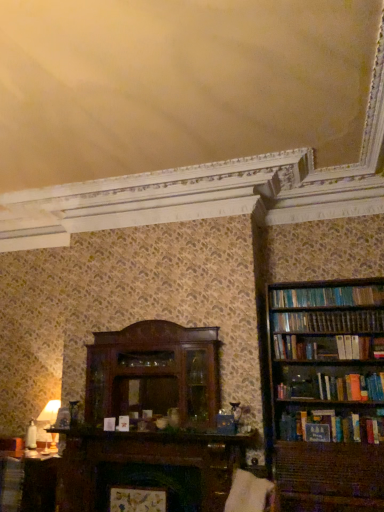
Locate an element on the screen. matte brown table at lower left is located at coordinates (x=28, y=484).

The height and width of the screenshot is (512, 384). What do you see at coordinates (328, 394) in the screenshot? I see `wooden bookshelf at right` at bounding box center [328, 394].

In order to face white fabric swivel chair at lower center, should I rotate leftwards or rightwards?

Rotate your view right by about 7.293°.

Identify the location of matte brown table at lower left. (28, 484).

Looking at this image, which object is further away from the camera taking this photo, matte brown table at lower left or wooden bookshelf at right?

matte brown table at lower left is further away from the camera.

In the scene shown: How much distance is there between matte brown table at lower left and wooden bookshelf at right?

The distance of matte brown table at lower left from wooden bookshelf at right is 2.63 meters.

The height and width of the screenshot is (512, 384). What are the coordinates of `table on the left of wooden bookshelf at right` in the screenshot? It's located at (28, 484).

From the image's perspective, is matte brown table at lower left on top of wooden bookshelf at right?

No, from the image's perspective, matte brown table at lower left is not above wooden bookshelf at right.

This screenshot has height=512, width=384. In order to click on bookcase that appears behind the white fabric swivel chair at lower center in this screenshot , I will do `click(328, 394)`.

Based on the photo, is wooden bookshelf at right to the left of white fabric swivel chair at lower center from the viewer's perspective?

No.

Could you tell me if wooden bookshelf at right is turned towards white fabric swivel chair at lower center?

Yes, wooden bookshelf at right faces towards white fabric swivel chair at lower center.

Considering the relative sizes of wooden bookshelf at right and white fabric swivel chair at lower center in the image provided, is wooden bookshelf at right bigger than white fabric swivel chair at lower center?

Yes, wooden bookshelf at right is bigger than white fabric swivel chair at lower center.

The width and height of the screenshot is (384, 512). What are the coordinates of `table lamp on the right of matte brown book at lower left` in the screenshot? It's located at (48, 426).

Is matte brown book at lower left far from matte white table lamp at left?

No, matte brown book at lower left is in close proximity to matte white table lamp at left.

Between matte brown book at lower left and matte white table lamp at left, which one appears on the right side from the viewer's perspective?

matte white table lamp at left.

Is matte white table lamp at left a part of matte brown book at lower left?

No.

Can you tell me how much white fabric swivel chair at lower center and matte brown book at lower left differ in facing direction?

88.9 degrees separate the facing orientations of white fabric swivel chair at lower center and matte brown book at lower left.

Which is more to the right, white fabric swivel chair at lower center or matte brown book at lower left?

white fabric swivel chair at lower center.

Could you tell me if white fabric swivel chair at lower center is turned towards matte brown book at lower left?

No, white fabric swivel chair at lower center is not oriented towards matte brown book at lower left.

Does white fabric swivel chair at lower center have a larger size compared to matte brown book at lower left?

Yes, white fabric swivel chair at lower center is bigger than matte brown book at lower left.

Find the location of a particular element. swivel chair above the matte brown table at lower left (from the image's perspective) is located at coordinates (250, 493).

From a real-world perspective, who is located lower, white fabric swivel chair at lower center or matte brown table at lower left?

matte brown table at lower left, from a real-world perspective.

Is white fabric swivel chair at lower center oriented away from matte brown table at lower left?

No, white fabric swivel chair at lower center's orientation is not away from matte brown table at lower left.

Considering the relative sizes of white fabric swivel chair at lower center and matte brown table at lower left in the image provided, is white fabric swivel chair at lower center taller than matte brown table at lower left?

No.

Consider the image. From the image's perspective, is matte brown table at lower left positioned above or below matte white table lamp at left?

Based on their image positions, matte brown table at lower left is located beneath matte white table lamp at left.

How different are the orientations of matte brown table at lower left and matte white table lamp at left in degrees?

The angle between the facing direction of matte brown table at lower left and the facing direction of matte white table lamp at left is 2.12 degrees.

Is matte brown table at lower left facing towards matte white table lamp at left?

No.

Considering the sizes of objects matte brown table at lower left and matte white table lamp at left in the image provided, who is taller, matte brown table at lower left or matte white table lamp at left?

With more height is matte brown table at lower left.

Can you confirm if wooden bookshelf at right is wider than matte white table lamp at left?

Yes.

From the picture: Would you say matte white table lamp at left is part of wooden bookshelf at right's contents?

No, matte white table lamp at left is located outside of wooden bookshelf at right.

Looking at this image, from a real-world perspective, is wooden bookshelf at right on matte white table lamp at left?

Correct, in the physical world, wooden bookshelf at right is higher than matte white table lamp at left.

Find the location of a particular element. The width and height of the screenshot is (384, 512). bookcase located in front of the matte white table lamp at left is located at coordinates (328, 394).

At what (x,y) coordinates should I click in order to perform the action: click on table that appears below the wooden bookshelf at right (from a real-world perspective). Please return your answer as a coordinate pair (x, y). The width and height of the screenshot is (384, 512). Looking at the image, I should click on (28, 484).

The height and width of the screenshot is (512, 384). Identify the location of bookcase above the white fabric swivel chair at lower center (from the image's perspective). (328, 394).

Estimate the real-world distances between objects in this image. Which object is closer to matte white table lamp at left, matte brown table at lower left or matte brown book at lower left?

matte brown table at lower left.

Looking at the image, which one is located closer to matte brown table at lower left, wooden bookshelf at right or matte brown book at lower left?

Among the two, matte brown book at lower left is located nearer to matte brown table at lower left.

Based on their spatial positions, is matte white table lamp at left or matte brown book at lower left closer to wooden bookshelf at right?

Among the two, matte white table lamp at left is located nearer to wooden bookshelf at right.

Estimate the real-world distances between objects in this image. Which object is closer to matte brown table at lower left, matte white table lamp at left or wooden bookshelf at right?

matte white table lamp at left is closer to matte brown table at lower left.

Based on their spatial positions, is wooden bookshelf at right or matte brown book at lower left further from matte white table lamp at left?

Based on the image, wooden bookshelf at right appears to be further to matte white table lamp at left.

When comparing their distances from matte white table lamp at left, does white fabric swivel chair at lower center or matte brown book at lower left seem closer?

The object closer to matte white table lamp at left is matte brown book at lower left.

Based on their spatial positions, is matte white table lamp at left or white fabric swivel chair at lower center closer to matte brown book at lower left?

matte white table lamp at left is positioned closer to the anchor matte brown book at lower left.

From the image, which object appears to be nearer to matte brown book at lower left, wooden bookshelf at right or matte brown table at lower left?

matte brown table at lower left.

This screenshot has width=384, height=512. Identify the location of table lamp between matte brown table at lower left and wooden bookshelf at right from left to right. (48, 426).

Where is `book between matte brown table at lower left and white fabric swivel chair at lower center`? This screenshot has height=512, width=384. book between matte brown table at lower left and white fabric swivel chair at lower center is located at coordinates (11, 483).

Find the location of `swivel chair between matte brown book at lower left and wooden bookshelf at right from left to right`. swivel chair between matte brown book at lower left and wooden bookshelf at right from left to right is located at coordinates (250, 493).

Where is `book between matte brown table at lower left and wooden bookshelf at right`? The image size is (384, 512). book between matte brown table at lower left and wooden bookshelf at right is located at coordinates (11, 483).